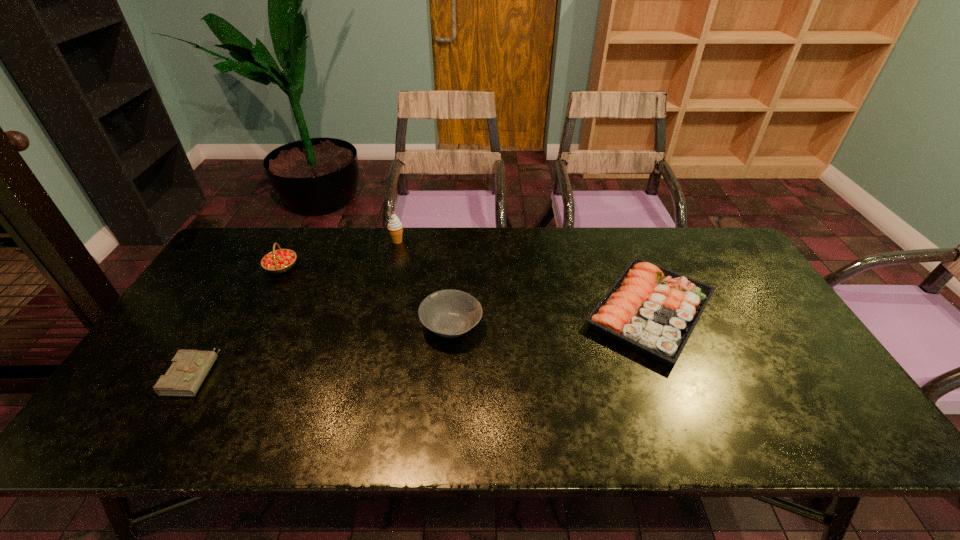
Identify the location of free space that satisfies the following two spatial constraints: 1. on the back side of the platter; 2. on the left side of the diary. The width and height of the screenshot is (960, 540). (229, 311).

The width and height of the screenshot is (960, 540). Find the location of `free location that satisfies the following two spatial constraints: 1. on the back side of the strawberry; 2. on the left side of the diary`. free location that satisfies the following two spatial constraints: 1. on the back side of the strawberry; 2. on the left side of the diary is located at coordinates (256, 267).